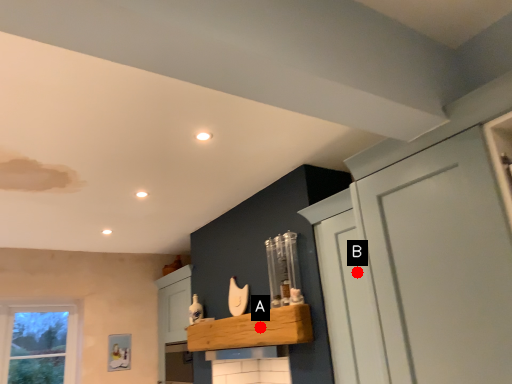
Question: Two points are circled on the image, labeled by A and B beside each circle. Which point is farther to the camera?

Choices:
 (A) A is further
 (B) B is further

Answer: (A)